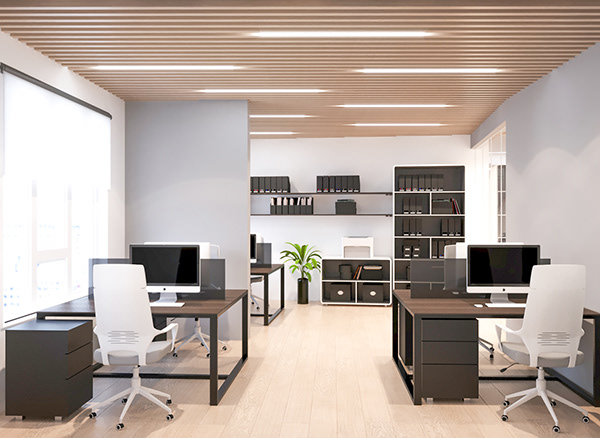
This screenshot has height=438, width=600. Identify the location of monitor. (505, 266), (461, 254), (204, 250), (177, 259), (252, 250).